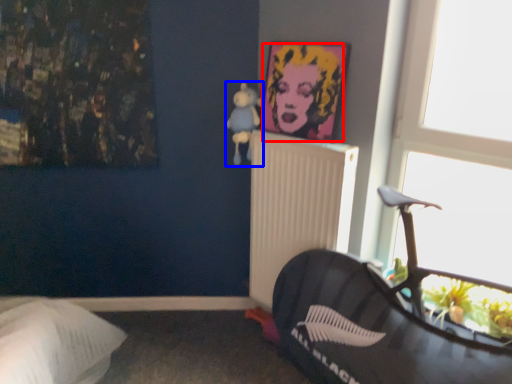
Question: Which object is closer to the camera taking this photo, person (highlighted by a red box) or toy (highlighted by a blue box)?

Choices:
 (A) person
 (B) toy

Answer: (A)